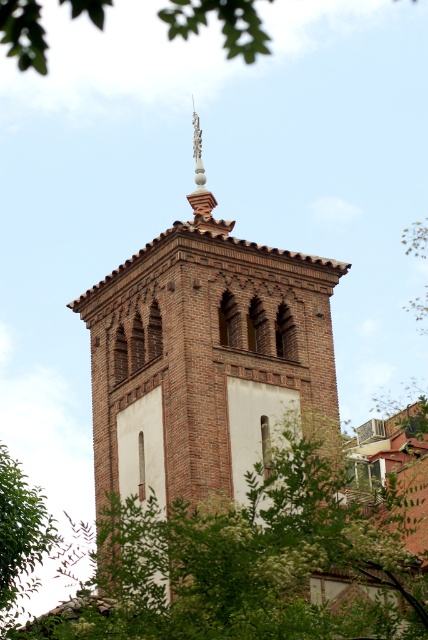
Question: Is green leafy tree at center to the right of green leafy tree at upper left from the viewer's perspective?

Choices:
 (A) yes
 (B) no

Answer: (B)

Question: Among these points, which one is farthest from the camera?

Choices:
 (A) (214, 362)
 (B) (41, 548)

Answer: (A)

Question: Can you confirm if brown brick tower at center is positioned to the left of green leafy tree at lower left?

Choices:
 (A) yes
 (B) no

Answer: (B)

Question: Estimate the real-world distances between objects in this image. Which object is farther from the green leafy tree at upper left?

Choices:
 (A) brown brick tower at center
 (B) green leafy tree at center

Answer: (B)

Question: Among these objects, which one is farthest from the camera?

Choices:
 (A) green leafy tree at upper left
 (B) green leafy tree at center

Answer: (A)

Question: Does brown brick tower at center appear over green leafy tree at lower left?

Choices:
 (A) no
 (B) yes

Answer: (B)